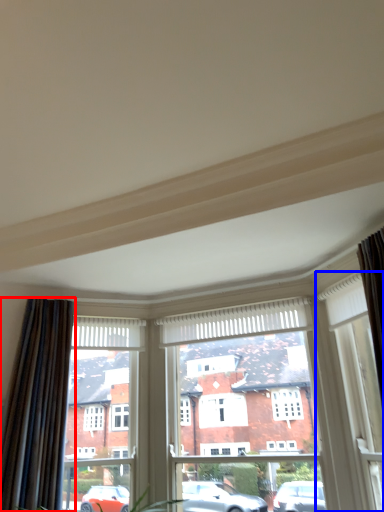
Question: Among these objects, which one is farthest to the camera, curtain (highlighted by a red box) or window (highlighted by a blue box)?

Choices:
 (A) curtain
 (B) window

Answer: (A)